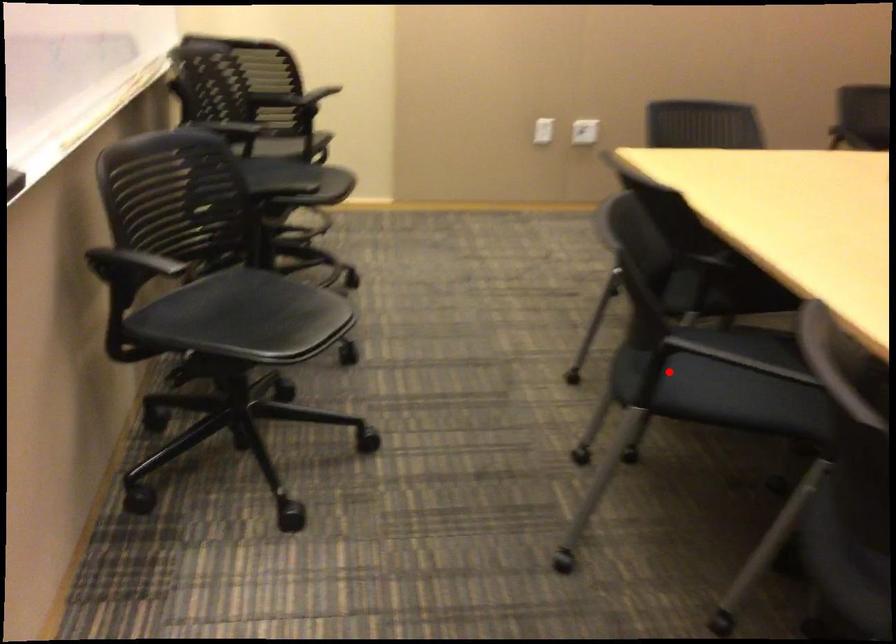
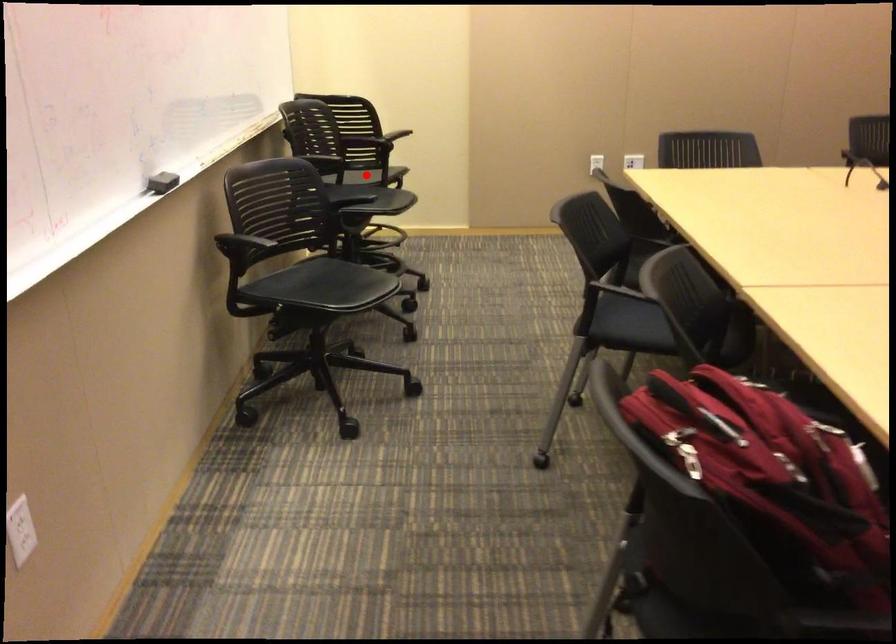
I am providing you with two images of the same scene from different viewpoints. A red point is marked on the first image and another point is marked on the second image. Do the highlighted points in image1 and image2 indicate the same real-world spot?

No